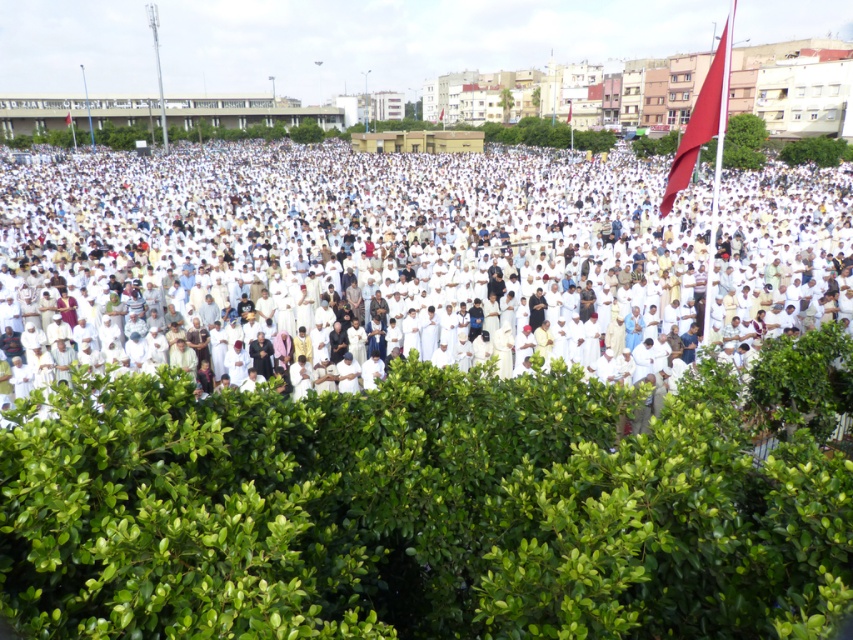
Question: Is white matte clothing at center bigger than matte red flag at upper right?

Choices:
 (A) yes
 (B) no

Answer: (A)

Question: Which point is farther from the camera taking this photo?

Choices:
 (A) (213, 182)
 (B) (689, 120)

Answer: (A)

Question: Is white matte clothing at center bigger than matte red flag at upper right?

Choices:
 (A) yes
 (B) no

Answer: (A)

Question: In this image, where is white matte clothing at center located relative to matte red flag at upper right?

Choices:
 (A) above
 (B) below

Answer: (A)

Question: Among these objects, which one is farthest from the camera?

Choices:
 (A) matte red flag at upper right
 (B) white matte clothing at center

Answer: (A)